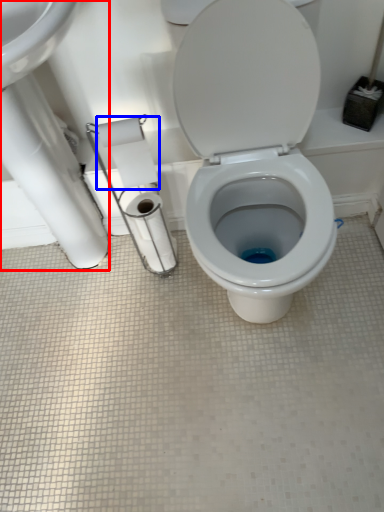
Question: Which of the following is the closest to the observer, sink (highlighted by a red box) or toilet paper (highlighted by a blue box)?

Choices:
 (A) sink
 (B) toilet paper

Answer: (A)